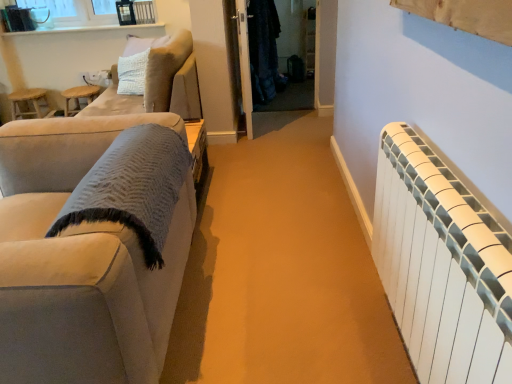
Question: Is the depth of white glossy window sill at upper left less than that of wooden stool at left?

Choices:
 (A) yes
 (B) no

Answer: (B)

Question: Is white glossy window sill at upper left not close to wooden stool at left?

Choices:
 (A) yes
 (B) no

Answer: (B)

Question: Is white glossy window sill at upper left outside of wooden stool at left?

Choices:
 (A) no
 (B) yes

Answer: (B)

Question: Does white glossy window sill at upper left turn towards wooden stool at left?

Choices:
 (A) no
 (B) yes

Answer: (A)

Question: From a real-world perspective, is white glossy window sill at upper left physically above wooden stool at left?

Choices:
 (A) no
 (B) yes

Answer: (B)

Question: Is white glossy door at center inside or outside of wooden stool at left?

Choices:
 (A) inside
 (B) outside

Answer: (B)

Question: From the image's perspective, is white glossy door at center located above or below wooden stool at left?

Choices:
 (A) above
 (B) below

Answer: (A)

Question: Based on their sizes in the image, would you say white glossy door at center is bigger or smaller than wooden stool at left?

Choices:
 (A) big
 (B) small

Answer: (A)

Question: Considering their positions, is white glossy door at center located in front of or behind wooden stool at left?

Choices:
 (A) front
 (B) behind

Answer: (A)

Question: Looking at the image, does white plastic radiator at right seem bigger or smaller compared to white glossy door at center?

Choices:
 (A) small
 (B) big

Answer: (A)

Question: Which is correct: white plastic radiator at right is inside white glossy door at center, or outside of it?

Choices:
 (A) inside
 (B) outside

Answer: (B)

Question: In terms of height, does white plastic radiator at right look taller or shorter compared to white glossy door at center?

Choices:
 (A) short
 (B) tall

Answer: (A)

Question: Does point (401, 306) appear closer or farther from the camera than point (236, 13)?

Choices:
 (A) closer
 (B) farther

Answer: (A)

Question: Is dark matte coat at center situated inside white plastic radiator at right or outside?

Choices:
 (A) outside
 (B) inside

Answer: (A)

Question: Is dark matte coat at center in front of or behind white plastic radiator at right in the image?

Choices:
 (A) front
 (B) behind

Answer: (B)